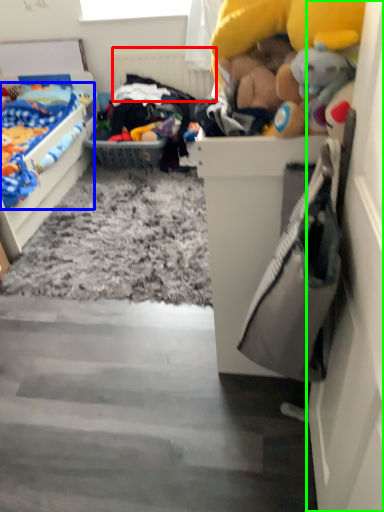
Question: Which object is positioned closest to radiator (highlighted by a red box)? Select from toy (highlighted by a blue box) and door (highlighted by a green box).

Choices:
 (A) toy
 (B) door

Answer: (A)